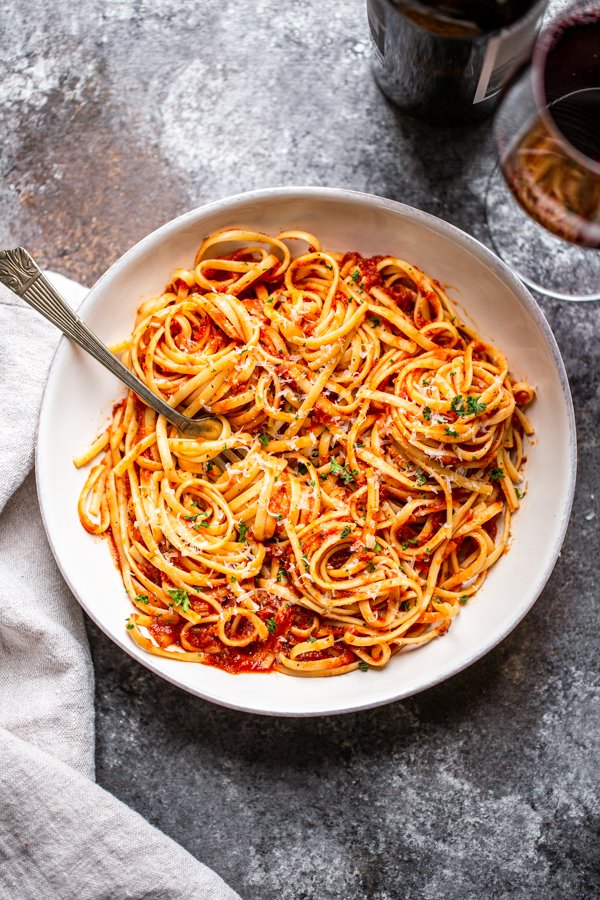
You are a GUI agent. You are given a task and a screenshot of the screen. Output one action in this format:
    pyautogui.click(x=<x>, y=<y>)
    Task: Click on the rim of bowl
    
    Given the screenshot: What is the action you would take?
    pyautogui.click(x=511, y=624)